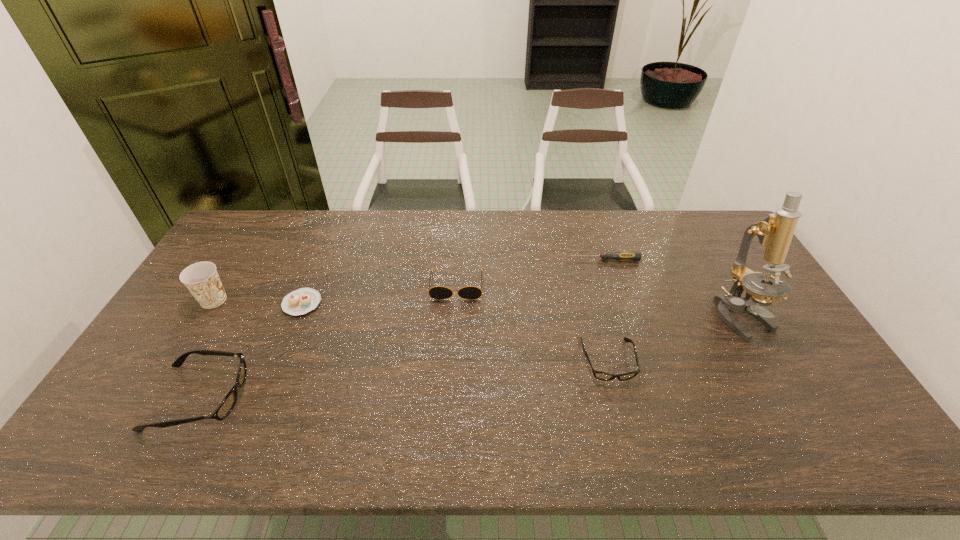
This screenshot has width=960, height=540. I want to click on vacant space located 0.050m on the front-facing side of the right spectacles, so click(618, 402).

The height and width of the screenshot is (540, 960). What are the coordinates of `free location located insert the shortest object into a screw head` in the screenshot? It's located at (525, 260).

The height and width of the screenshot is (540, 960). What are the coordinates of `free spot located 0.140m insert the shortest object into a screw head` in the screenshot? It's located at (529, 260).

Find the location of a particular element. vacant area situated insert the shortest object into a screw head is located at coordinates (511, 260).

The width and height of the screenshot is (960, 540). I want to click on vacant area situated 0.200m on the left of the microscope, so click(x=645, y=316).

Locate an element on the screen. blank area located on the front-facing side of the sunglasses is located at coordinates (451, 382).

Where is `free region located on the back of the second tallest object`? This screenshot has height=540, width=960. free region located on the back of the second tallest object is located at coordinates pos(261,224).

The width and height of the screenshot is (960, 540). I want to click on blank area located on the front of the cupcake, so click(271, 382).

Locate an element on the screen. spectacles positioned at the left edge is located at coordinates (226, 406).

Where is `Dixie cup situated at the left edge`? The image size is (960, 540). Dixie cup situated at the left edge is located at coordinates (201, 279).